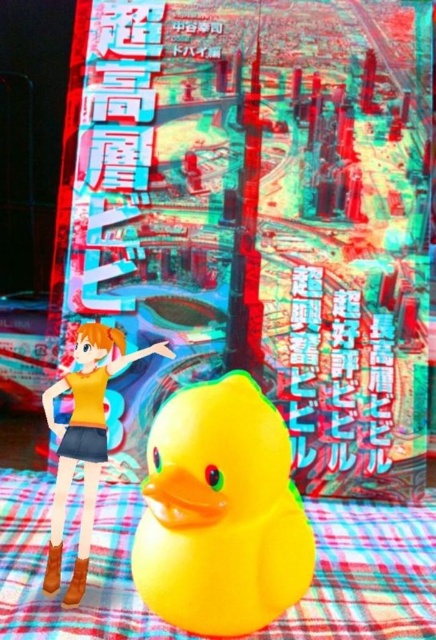
Between point (159, 550) and point (118, 349), which one is positioned in front?

Point (159, 550)

Locate an element on the screen. The width and height of the screenshot is (436, 640). yellow rubber duck at center is located at coordinates (221, 513).